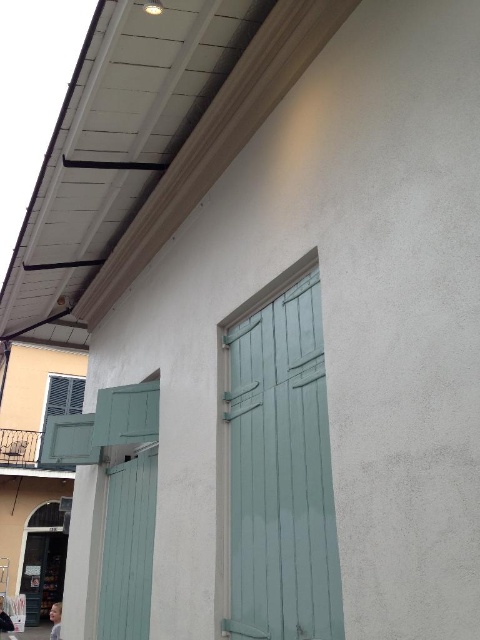
You are standing in front of the building and want to take a photo. There are two points marked on the wall, point 1 at coordinates point (276, 573) and point 2 at coordinates point (136, 502). Which point will appear larger in your camera view?

Point (276, 573) will appear larger in the camera view because it is closer to the camera than point (136, 502).

You are standing 3 meters away from a building wall with teal shutters and a white overhang. You want to place a small plant exactly at the point marked by coordinates point (x=284, y=346). Can you reach that point with your current position?

The point (x=284, y=346) is 2.97 meters from the viewer, so yes, you can reach it since you are standing exactly 3 meters away.

You are an architect designing a new building and want to ensure proper ventilation. You observe the teal wood shutter at center and the teal wood shutter at lower left in the image. Which shutter should you open to allow more airflow into the building, and why?

The teal wood shutter at center should be opened because it is taller than the teal wood shutter at lower left, allowing more air to pass through.